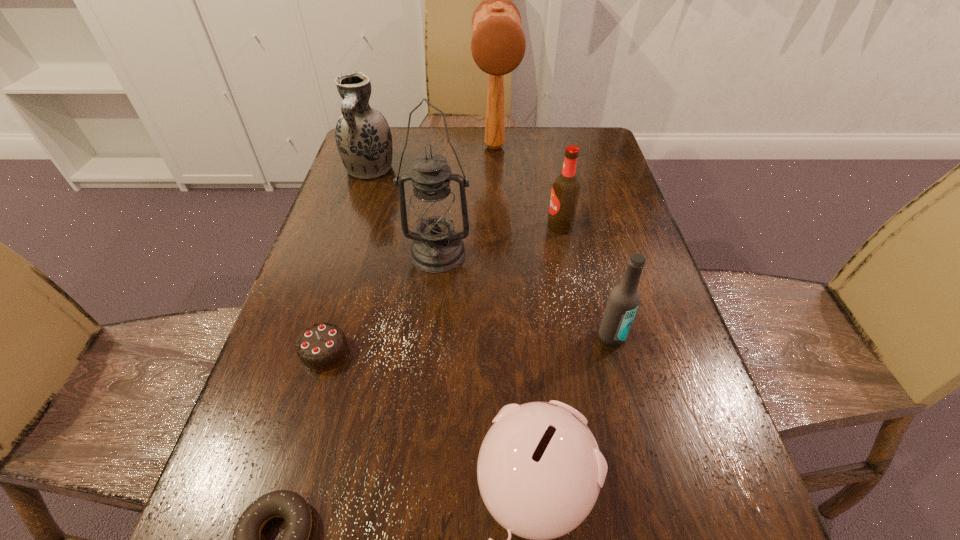
The height and width of the screenshot is (540, 960). I want to click on vacant space at the right edge of the desktop, so click(x=605, y=213).

I want to click on blank space at the far left corner, so click(x=399, y=145).

At what (x,y) coordinates should I click in order to perform the action: click on free space at the far right corner of the desktop. Please return your answer as a coordinate pair (x, y). The height and width of the screenshot is (540, 960). Looking at the image, I should click on (564, 147).

Where is `empty location between the chocolate cake and the sixth shortest object`? This screenshot has width=960, height=540. empty location between the chocolate cake and the sixth shortest object is located at coordinates (348, 261).

Identify the location of free area in between the farther beer bottle and the seventh tallest object. Image resolution: width=960 pixels, height=540 pixels. (443, 289).

You are a GUI agent. You are given a task and a screenshot of the screen. Output one action in this format:
    pyautogui.click(x=<x>, y=<y>)
    Task: Click on the vacant space that is in between the nearer beer bottle and the oil lamp
    The width and height of the screenshot is (960, 540).
    Given the screenshot: What is the action you would take?
    pyautogui.click(x=525, y=295)

Identify the location of empty space between the right beer bottle and the oil lamp. pyautogui.click(x=525, y=295).

At what (x,y) coordinates should I click in order to perform the action: click on vacant region between the farther beer bottle and the rightmost object. Please return your answer as a coordinate pair (x, y). Image resolution: width=960 pixels, height=540 pixels. Looking at the image, I should click on (586, 282).

You are a GUI agent. You are given a task and a screenshot of the screen. Output one action in this format:
    pyautogui.click(x=<x>, y=<y>)
    Task: Click on the empty space that is in between the oil lamp and the nearer beer bottle
    The image size is (960, 540).
    Given the screenshot: What is the action you would take?
    525,295

Where is `object that is the second nearest to the doughnut`? The width and height of the screenshot is (960, 540). object that is the second nearest to the doughnut is located at coordinates (539, 470).